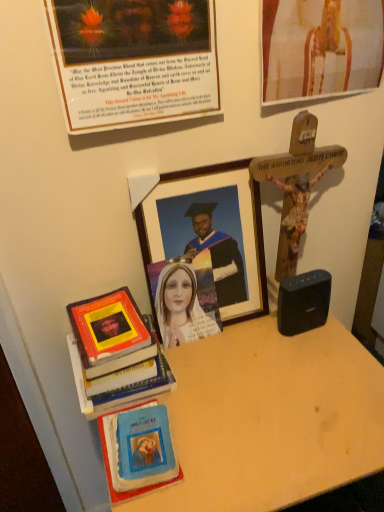
Question: Is wooden crucifix at upper right, the 1th picture frame positioned from the top, inside the boundaries of black plastic speaker at right, or outside?

Choices:
 (A) outside
 (B) inside

Answer: (A)

Question: Based on their positions, is wooden crucifix at upper right, the third picture frame in the bottom-to-top sequence, located to the left or right of black plastic speaker at right?

Choices:
 (A) left
 (B) right

Answer: (B)

Question: Which is farther from the matte paper picture frame at upper left, which is the 2th picture frame in bottom-to-top order?

Choices:
 (A) matte paper portrait at center
 (B) wooden picture frame at center, which is the 1th picture frame from bottom to top
 (C) wooden table at lower left
 (D) wooden crucifix at upper right, the 1th picture frame positioned from the top
 (E) blue matte book at center, which is the 1th book in bottom-to-top order

Answer: (E)

Question: Which object is positioned farthest from the black plastic speaker at right?

Choices:
 (A) wooden crucifix at upper right, the 1th picture frame positioned from the top
 (B) wooden table at lower left
 (C) matte paper portrait at center
 (D) hardcover book at left, arranged as the first book when viewed from the top
 (E) matte paper picture frame at upper left, which is the 2th picture frame in top-to-bottom order

Answer: (E)